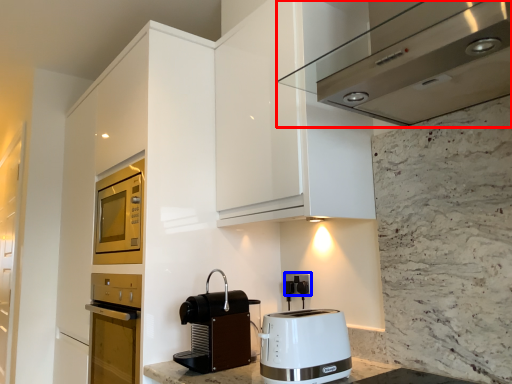
Question: Which object appears closest to the camera in this image, home appliance (highlighted by a red box) or electric outlet (highlighted by a blue box)?

Choices:
 (A) home appliance
 (B) electric outlet

Answer: (A)